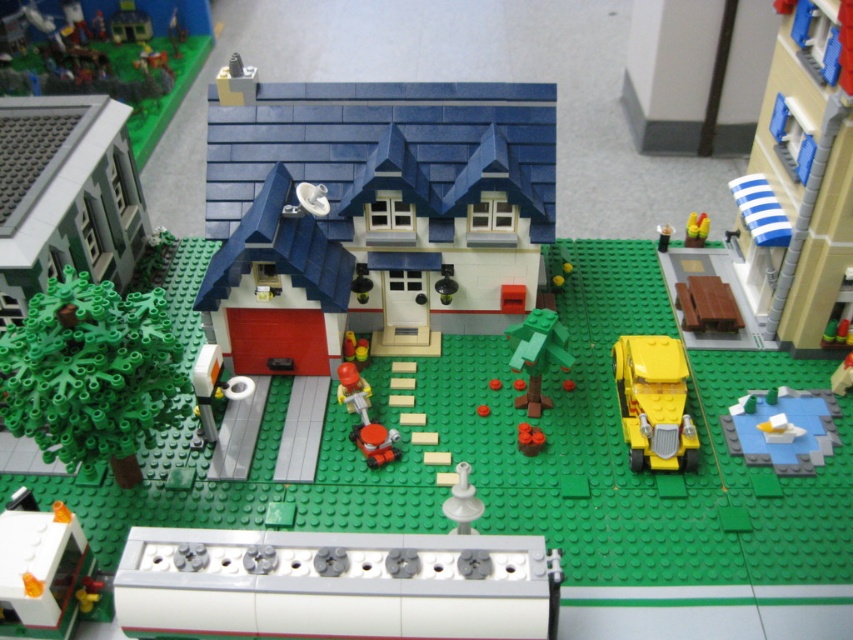
You are a drone operator trying to capture aerial shots of a Lego neighborhood. You have two points marked on your map for potential takeoff locations. The first point is at coordinates point (849, 38), and the second is at point (358, 380). Which takeoff point is closer to the camera to ensure better visibility of the two story house with a blue roof?

Point (849, 38) is closer to the viewer than point (358, 380), so it would provide better visibility of the two story house with a blue roof.

You are a child playing with a Lego set and want to place both the green matte tree at lower left and the white plastic boat at lower right in the scene. Since you have limited space, can you determine which object takes up more space?

The green matte tree at lower left has a larger size compared to the white plastic boat at lower right, so it takes up more space.

You are a delivery robot trying to reach the yellow plastic car at right. The coordinates given are in a normalized system where the bottom left corner is the origin. The point at (799,180) is where the car is located. Can you confirm the car is at the right side of the image?

The point at (799,180) indicates the yellow plastic car at right is located at the right side of the image.